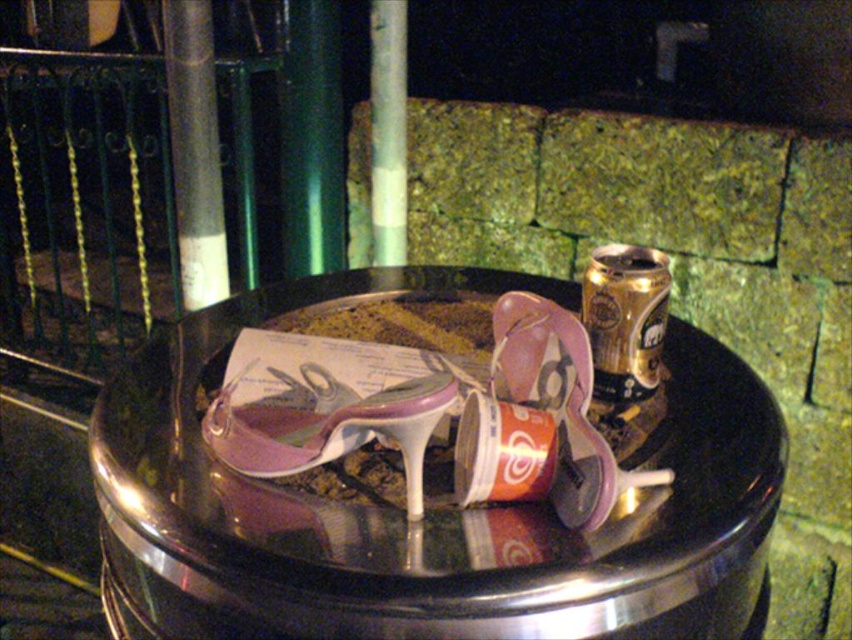
Question: Which object is the farthest from the gold metallic can at upper right?

Choices:
 (A) matte pink high-heeled sandal at center
 (B) purple glossy high-heeled sandal at center

Answer: (B)

Question: Estimate the real-world distances between objects in this image. Which object is closer to the purple glossy high-heeled sandal at center?

Choices:
 (A) matte pink high-heeled sandal at center
 (B) gold metallic can at upper right

Answer: (A)

Question: Is purple glossy high-heeled sandal at center smaller than gold metallic can at upper right?

Choices:
 (A) yes
 (B) no

Answer: (B)

Question: Is purple glossy high-heeled sandal at center to the left of gold metallic can at upper right from the viewer's perspective?

Choices:
 (A) no
 (B) yes

Answer: (B)

Question: Does purple glossy high-heeled sandal at center have a smaller size compared to matte pink high-heeled sandal at center?

Choices:
 (A) no
 (B) yes

Answer: (A)

Question: Which object appears closest to the camera in this image?

Choices:
 (A) gold metallic can at upper right
 (B) purple glossy high-heeled sandal at center

Answer: (B)